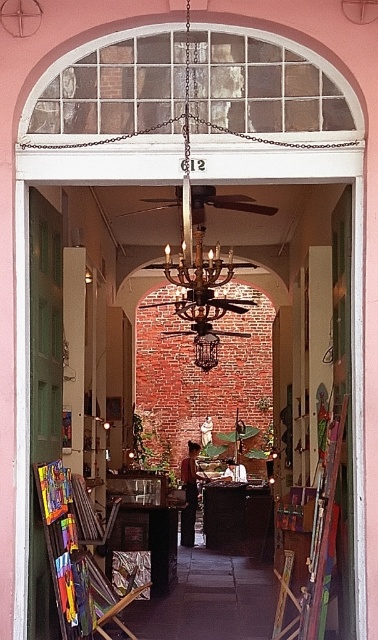
Between wooden easel at left and bronze textured chandelier at center, which one is positioned lower?

wooden easel at left is below.

Does wooden easel at left have a lesser width compared to bronze textured chandelier at center?

Correct, wooden easel at left's width is less than bronze textured chandelier at center's.

Which is behind, point (83, 572) or point (218, 248)?

The point (218, 248) is more distant.

At what (x,y) coordinates should I click in order to perform the action: click on wooden easel at left. Please return your answer as a coordinate pair (x, y). This screenshot has height=640, width=378. Looking at the image, I should click on (79, 556).